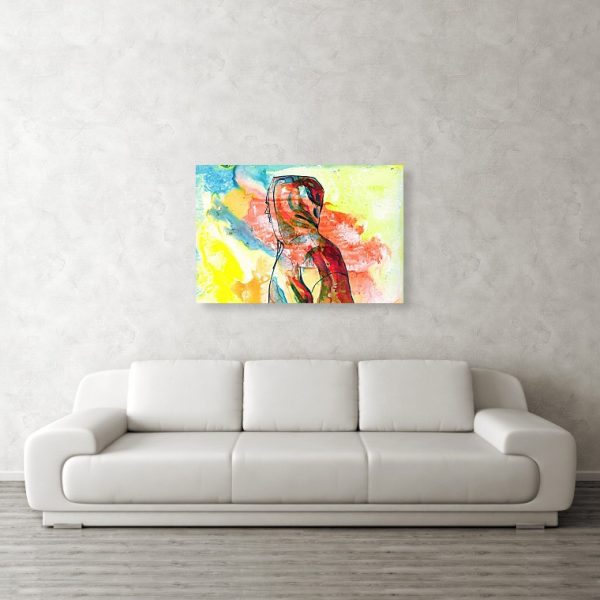
Locate an element on the screen. The height and width of the screenshot is (600, 600). seat is located at coordinates pyautogui.click(x=416, y=447).